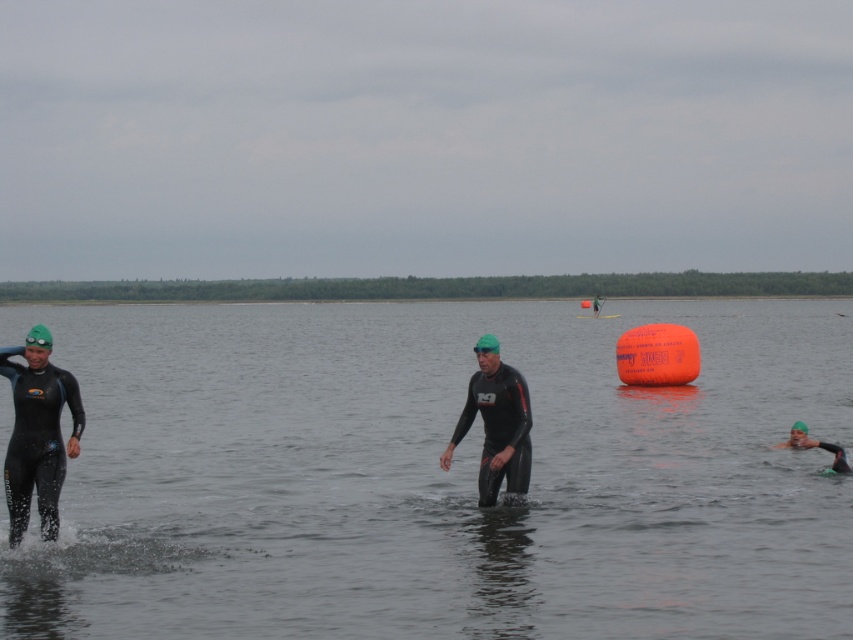
Question: Which of the following is the farthest from the observer?

Choices:
 (A) (38, 349)
 (B) (512, 481)
 (C) (218, 532)

Answer: (C)

Question: Which point appears closest to the camera in this image?

Choices:
 (A) (27, 465)
 (B) (524, 486)
 (C) (459, 502)

Answer: (A)

Question: Is transparent water at center bigger than black matte wetsuit at center?

Choices:
 (A) yes
 (B) no

Answer: (A)

Question: Is transparent water at center bigger than black matte wetsuit at left?

Choices:
 (A) yes
 (B) no

Answer: (A)

Question: Is black matte wetsuit at left thinner than black matte wetsuit at center?

Choices:
 (A) no
 (B) yes

Answer: (B)

Question: Estimate the real-world distances between objects in this image. Which object is closer to the black matte wetsuit at center?

Choices:
 (A) transparent water at center
 (B) black matte wetsuit at left

Answer: (B)